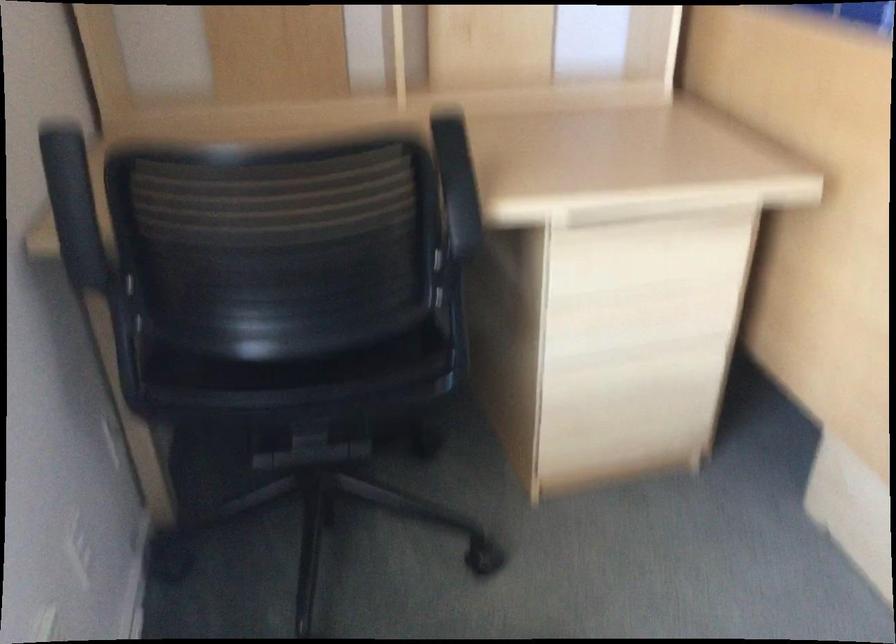
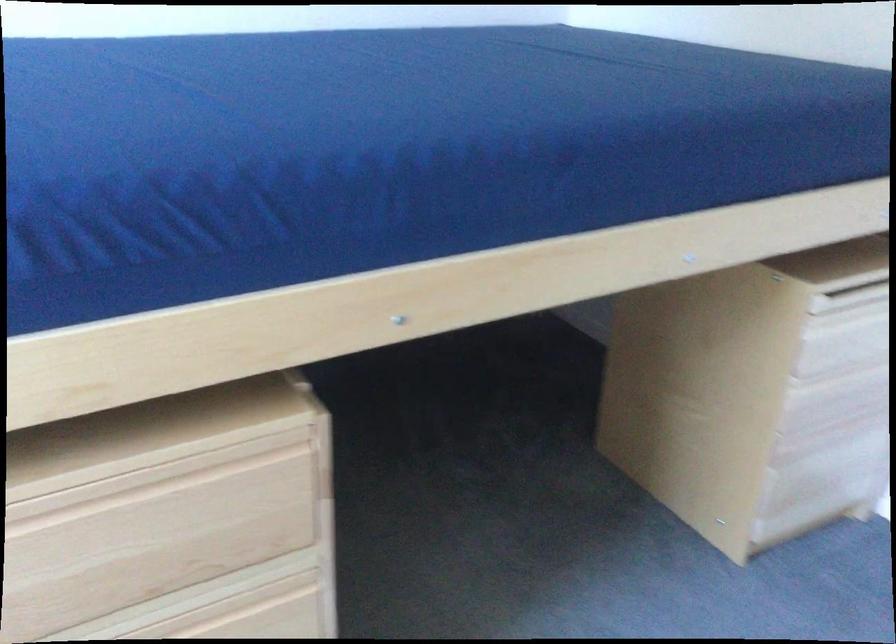
Question: What movement of the cameraman would produce the second image?

Choices:
 (A) Left
 (B) Right
 (C) Forward
 (D) Backward

Answer: (B)